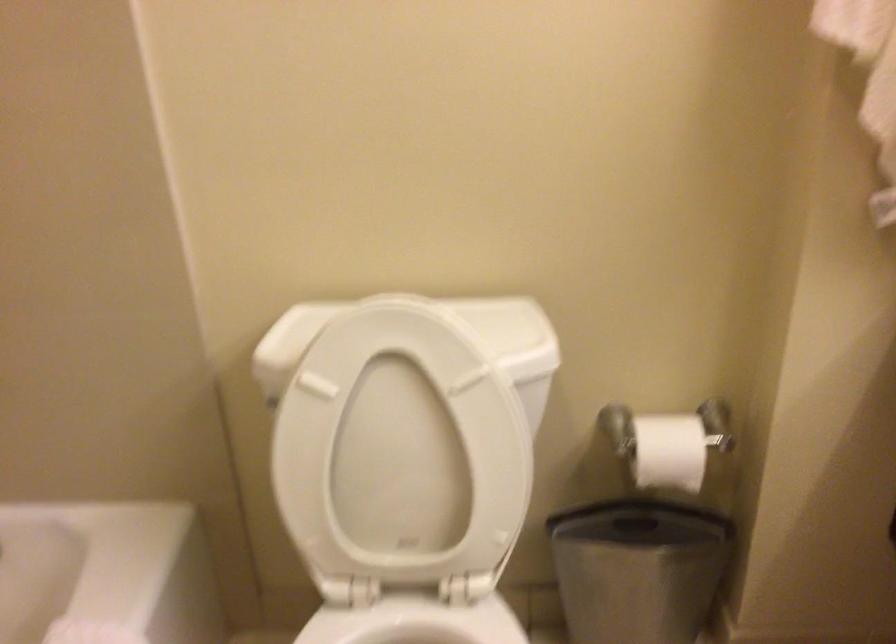
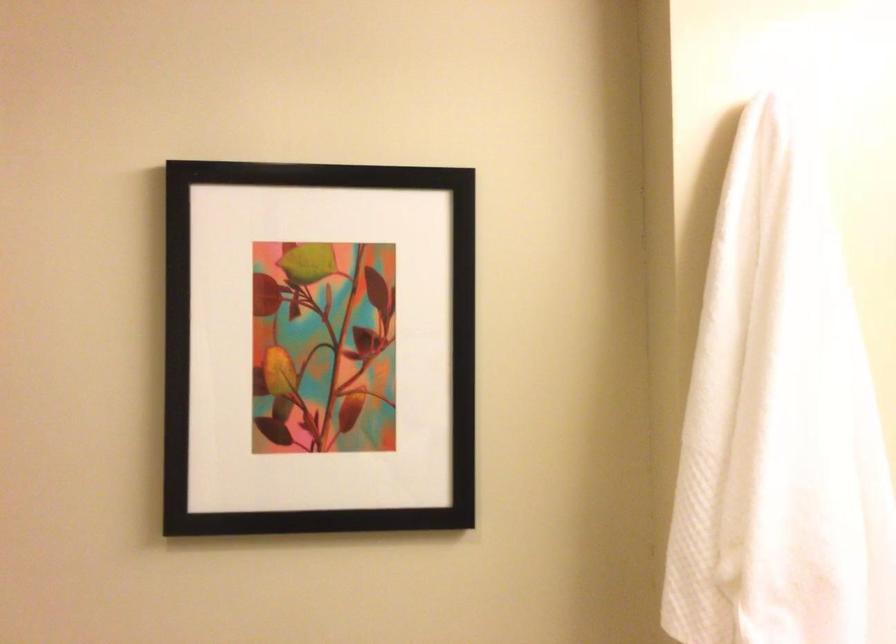
Question: The first image is from the beginning of the video and the second image is from the end. How did the camera likely rotate when shooting the video?

Choices:
 (A) Left
 (B) Right
 (C) Up
 (D) Down

Answer: (C)